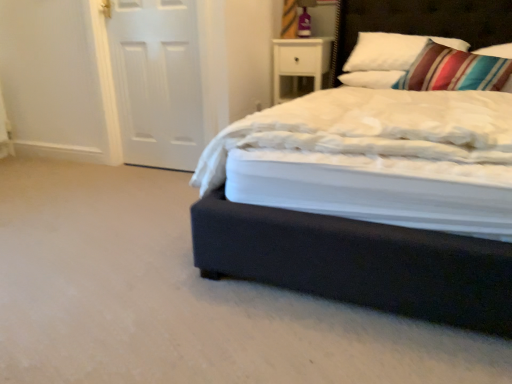
What is the approximate width of white soft pillow at upper right, the first pillow positioned from the left?

The width of white soft pillow at upper right, the first pillow positioned from the left, is 43.45 centimeters.

Where is `striped fabric pillow at upper right, which ranks as the second pillow in left-to-right order`? striped fabric pillow at upper right, which ranks as the second pillow in left-to-right order is located at coordinates (496, 51).

What do you see at coordinates (157, 81) in the screenshot? This screenshot has height=384, width=512. I see `white matte door at left` at bounding box center [157, 81].

Image resolution: width=512 pixels, height=384 pixels. Describe the element at coordinates (421, 22) in the screenshot. I see `dark wood headboard at upper right` at that location.

Based on the photo, what is the approximate height of dark wood headboard at upper right?

19.54 inches.

Locate an element on the screen. The width and height of the screenshot is (512, 384). white soft pillow at upper right, the first pillow positioned from the left is located at coordinates (373, 79).

Between dark wood headboard at upper right and white glossy nightstand at upper right, which one has more height?

dark wood headboard at upper right is taller.

Based on their positions, is dark wood headboard at upper right located to the left or right of white glossy nightstand at upper right?

In the image, dark wood headboard at upper right appears on the right side of white glossy nightstand at upper right.

Considering the sizes of objects dark wood headboard at upper right and white glossy nightstand at upper right in the image provided, who is wider, dark wood headboard at upper right or white glossy nightstand at upper right?

white glossy nightstand at upper right is wider.

Between dark wood headboard at upper right and white glossy nightstand at upper right, which one has smaller size?

white glossy nightstand at upper right is smaller.

Which object is wider, striped fabric pillow at upper right, which appears as the 1th pillow when viewed from the right, or white glossy nightstand at upper right?

With larger width is white glossy nightstand at upper right.

Considering the relative sizes of striped fabric pillow at upper right, which ranks as the second pillow in left-to-right order, and white glossy nightstand at upper right in the image provided, is striped fabric pillow at upper right, which ranks as the second pillow in left-to-right order, bigger than white glossy nightstand at upper right?

No, striped fabric pillow at upper right, which ranks as the second pillow in left-to-right order, is not bigger than white glossy nightstand at upper right.

Which is more to the left, striped fabric pillow at upper right, which ranks as the second pillow in left-to-right order, or white glossy nightstand at upper right?

Positioned to the left is white glossy nightstand at upper right.

Is striped fabric pillow at upper right, which ranks as the second pillow in left-to-right order, far away from white glossy nightstand at upper right?

Absolutely, striped fabric pillow at upper right, which ranks as the second pillow in left-to-right order, is distant from white glossy nightstand at upper right.

Is white soft pillow at upper right, the first pillow positioned from the left, positioned with its back to striped fabric pillow at upper right, which appears as the 1th pillow when viewed from the right?

No, striped fabric pillow at upper right, which appears as the 1th pillow when viewed from the right, is not at the back of white soft pillow at upper right, the first pillow positioned from the left.

From a real-world perspective, is white soft pillow at upper right, marked as the second pillow in a right-to-left arrangement, above or below striped fabric pillow at upper right, which appears as the 1th pillow when viewed from the right?

In terms of real-world spatial position, white soft pillow at upper right, marked as the second pillow in a right-to-left arrangement, is below striped fabric pillow at upper right, which appears as the 1th pillow when viewed from the right.

Which point is more distant from viewer, (389,88) or (490,53)?

The point (490,53) is farther from the camera.

Is white soft pillow at upper right, the first pillow positioned from the left, positioned far away from striped fabric pillow at upper right, which ranks as the second pillow in left-to-right order?

white soft pillow at upper right, the first pillow positioned from the left, is near striped fabric pillow at upper right, which ranks as the second pillow in left-to-right order, not far away.

Considering the relative positions of white matte door at left and striped fabric pillow at upper right, which appears as the 1th pillow when viewed from the right, in the image provided, is white matte door at left to the right of striped fabric pillow at upper right, which appears as the 1th pillow when viewed from the right, from the viewer's perspective?

No, white matte door at left is not to the right of striped fabric pillow at upper right, which appears as the 1th pillow when viewed from the right.

Could you tell me if white matte door at left is turned towards striped fabric pillow at upper right, which ranks as the second pillow in left-to-right order?

No, white matte door at left is not turned towards striped fabric pillow at upper right, which ranks as the second pillow in left-to-right order.

Looking at this image, from a real-world perspective, between white matte door at left and striped fabric pillow at upper right, which appears as the 1th pillow when viewed from the right, who is vertically higher?

In real-world perspective, striped fabric pillow at upper right, which appears as the 1th pillow when viewed from the right, is above.

Between white matte door at left and striped fabric pillow at upper right, which ranks as the second pillow in left-to-right order, which one has less height?

With less height is striped fabric pillow at upper right, which ranks as the second pillow in left-to-right order.

Is white matte door at left positioned beyond the bounds of white soft pillow at upper right, marked as the second pillow in a right-to-left arrangement?

Yes.

Can you confirm if white matte door at left is wider than white soft pillow at upper right, the first pillow positioned from the left?

Incorrect, the width of white matte door at left does not surpass that of white soft pillow at upper right, the first pillow positioned from the left.

Is white matte door at left looking in the opposite direction of white soft pillow at upper right, marked as the second pillow in a right-to-left arrangement?

That's not correct — white matte door at left is not looking away from white soft pillow at upper right, marked as the second pillow in a right-to-left arrangement.

From the picture: Is white matte door at left bigger than white soft pillow at upper right, the first pillow positioned from the left?

Indeed, white matte door at left has a larger size compared to white soft pillow at upper right, the first pillow positioned from the left.

Based on their positions, is white glossy nightstand at upper right located to the left or right of striped fabric pillow at upper right, which appears as the 1th pillow when viewed from the right?

white glossy nightstand at upper right is to the left of striped fabric pillow at upper right, which appears as the 1th pillow when viewed from the right.

Is white glossy nightstand at upper right not near striped fabric pillow at upper right, which appears as the 1th pillow when viewed from the right?

Indeed, white glossy nightstand at upper right is not near striped fabric pillow at upper right, which appears as the 1th pillow when viewed from the right.

Considering the sizes of white glossy nightstand at upper right and striped fabric pillow at upper right, which appears as the 1th pillow when viewed from the right, in the image, is white glossy nightstand at upper right taller or shorter than striped fabric pillow at upper right, which appears as the 1th pillow when viewed from the right,?

white glossy nightstand at upper right is taller than striped fabric pillow at upper right, which appears as the 1th pillow when viewed from the right.

Could striped fabric pillow at upper right, which ranks as the second pillow in left-to-right order, be considered to be inside white glossy nightstand at upper right?

Definitely not — striped fabric pillow at upper right, which ranks as the second pillow in left-to-right order, is not inside white glossy nightstand at upper right.

Is white matte door at left directly adjacent to dark wood headboard at upper right?

There is a gap between white matte door at left and dark wood headboard at upper right.

Could you tell me if white matte door at left is facing dark wood headboard at upper right?

No, white matte door at left is not turned towards dark wood headboard at upper right.

Visually, is white matte door at left positioned to the left or to the right of dark wood headboard at upper right?

From the image, it's evident that white matte door at left is to the left of dark wood headboard at upper right.

Who is smaller, white matte door at left or dark wood headboard at upper right?

white matte door at left is smaller.

The width and height of the screenshot is (512, 384). I want to click on headboard above the white glossy nightstand at upper right (from the image's perspective), so click(x=421, y=22).

Which pillow is the 2nd one when counting from the right side of the white glossy nightstand at upper right? Please provide its 2D coordinates.

[(496, 51)]

Which object lies further to the anchor point white glossy nightstand at upper right, striped fabric pillow at upper right, which appears as the 1th pillow when viewed from the right, or white matte door at left?

striped fabric pillow at upper right, which appears as the 1th pillow when viewed from the right, lies further to white glossy nightstand at upper right than the other object.

Looking at the image, which one is located closer to striped fabric pillow at upper right, which appears as the 1th pillow when viewed from the right, dark blue fabric bed at center or white soft pillow at upper right, marked as the second pillow in a right-to-left arrangement?

Based on the image, white soft pillow at upper right, marked as the second pillow in a right-to-left arrangement, appears to be nearer to striped fabric pillow at upper right, which appears as the 1th pillow when viewed from the right.

When comparing their distances from white matte door at left, does dark blue fabric bed at center or white soft pillow at upper right, the first pillow positioned from the left, seem further?

dark blue fabric bed at center.

Looking at the image, which one is located closer to dark wood headboard at upper right, white glossy nightstand at upper right or striped fabric pillow at upper right, which ranks as the second pillow in left-to-right order?

white glossy nightstand at upper right.

Estimate the real-world distances between objects in this image. Which object is further from white matte door at left, dark blue fabric bed at center or striped fabric pillow at upper right, which ranks as the second pillow in left-to-right order?

striped fabric pillow at upper right, which ranks as the second pillow in left-to-right order.

Estimate the real-world distances between objects in this image. Which object is further from dark blue fabric bed at center, striped fabric pillow at upper right, which appears as the 1th pillow when viewed from the right, or white matte door at left?

striped fabric pillow at upper right, which appears as the 1th pillow when viewed from the right, is further to dark blue fabric bed at center.

From the image, which object appears to be farther from white matte door at left, dark wood headboard at upper right or white glossy nightstand at upper right?

Among the two, dark wood headboard at upper right is located further to white matte door at left.

When comparing their distances from white soft pillow at upper right, marked as the second pillow in a right-to-left arrangement, does white glossy nightstand at upper right or white matte door at left seem closer?

white glossy nightstand at upper right.

At what (x,y) coordinates should I click in order to perform the action: click on pillow positioned between dark blue fabric bed at center and white soft pillow at upper right, the first pillow positioned from the left, from near to far. Please return your answer as a coordinate pair (x, y). The width and height of the screenshot is (512, 384). Looking at the image, I should click on (496, 51).

At what (x,y) coordinates should I click in order to perform the action: click on bed between white matte door at left and striped fabric pillow at upper right, which ranks as the second pillow in left-to-right order, in the horizontal direction. Please return your answer as a coordinate pair (x, y). The width and height of the screenshot is (512, 384). Looking at the image, I should click on (x=359, y=263).

Where is `pillow located between white glossy nightstand at upper right and striped fabric pillow at upper right, which appears as the 1th pillow when viewed from the right, in the left-right direction`? Image resolution: width=512 pixels, height=384 pixels. pillow located between white glossy nightstand at upper right and striped fabric pillow at upper right, which appears as the 1th pillow when viewed from the right, in the left-right direction is located at coordinates (373, 79).

Find the location of `nightstand between white matte door at left and white soft pillow at upper right, marked as the second pillow in a right-to-left arrangement, in the horizontal direction`. nightstand between white matte door at left and white soft pillow at upper right, marked as the second pillow in a right-to-left arrangement, in the horizontal direction is located at coordinates (300, 61).